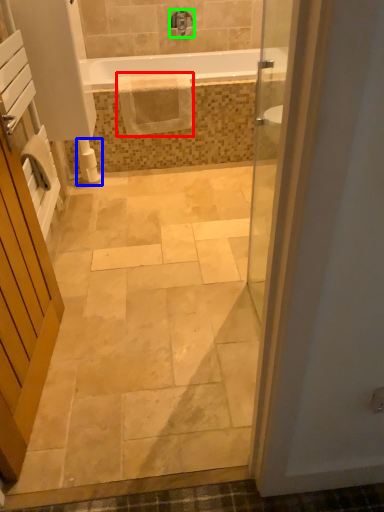
Question: Which is farther away from material (highlighted by a red box)? toilet paper (highlighted by a blue box) or tap (highlighted by a green box)?

Choices:
 (A) toilet paper
 (B) tap

Answer: (B)